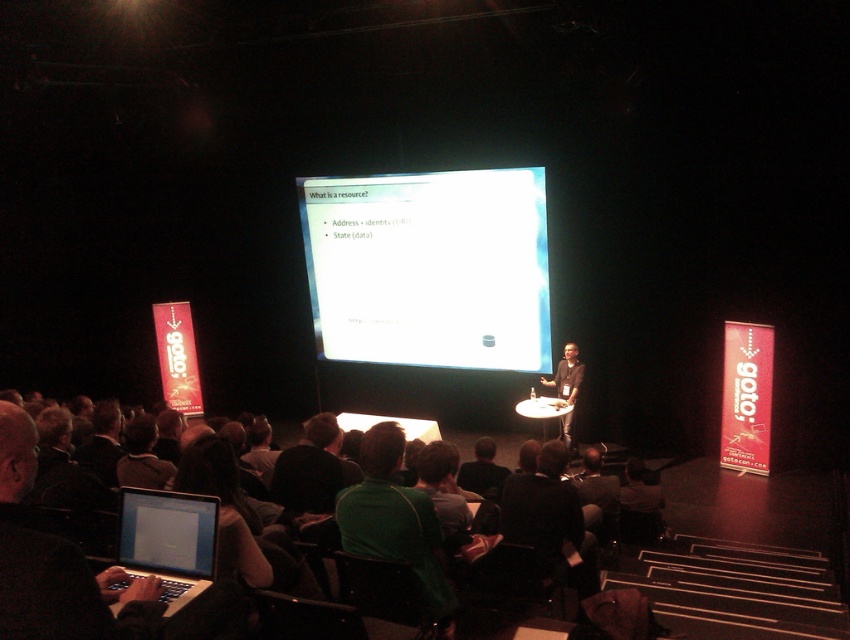
Who is more forward, (388, 314) or (183, 552)?

Point (183, 552) is more forward.

The width and height of the screenshot is (850, 640). What do you see at coordinates (429, 268) in the screenshot?
I see `white glossy projector screen at center` at bounding box center [429, 268].

Does point (326, 237) lie behind point (159, 598)?

Yes, point (326, 237) is farther from viewer.

The height and width of the screenshot is (640, 850). Identify the location of white glossy projector screen at center. click(x=429, y=268).

Does dark green fabric seats at lower center have a lesser width compared to dark brown shirt at center?

Incorrect, dark green fabric seats at lower center's width is not less than dark brown shirt at center's.

Which is more to the left, dark green fabric seats at lower center or dark brown shirt at center?

Positioned to the left is dark green fabric seats at lower center.

Which is in front, point (123, 609) or point (570, 385)?

Point (123, 609)

At what (x,y) coordinates should I click in order to perform the action: click on dark green fabric seats at lower center. Please return your answer as a coordinate pair (x, y). This screenshot has height=640, width=850. Looking at the image, I should click on (72, 570).

Between green fabric jacket at center and dark brown shirt at center, which one appears on the right side from the viewer's perspective?

dark brown shirt at center

You are a GUI agent. You are given a task and a screenshot of the screen. Output one action in this format:
    pyautogui.click(x=<x>, y=<y>)
    Task: Click on the green fabric jacket at center
    
    Given the screenshot: What is the action you would take?
    pyautogui.click(x=395, y=522)